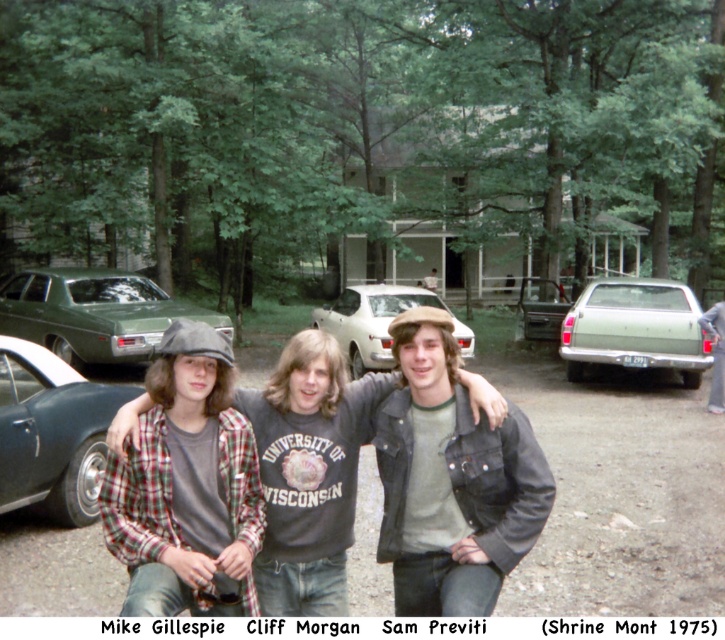
You are a photographer trying to capture a photo of the green matte sedan at left and the gray denim jacket at right. Which object is located more to the left in the scene?

The green matte sedan at left is more to the left than the gray denim jacket at right.